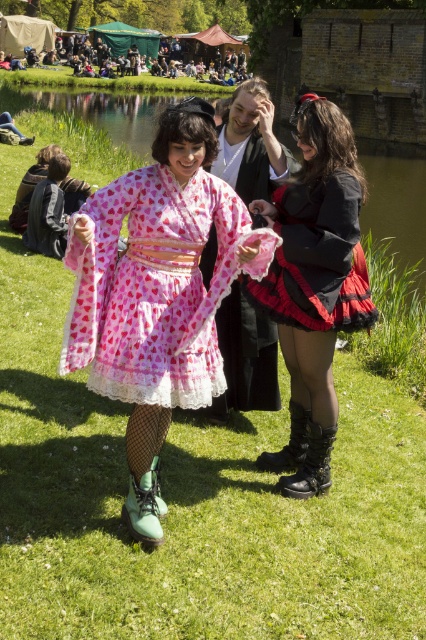
Question: Is matte black dress at center to the left of green matte boots at center from the viewer's perspective?

Choices:
 (A) yes
 (B) no

Answer: (A)

Question: Does green matte boots at center lie in front of green suede boot at lower center?

Choices:
 (A) yes
 (B) no

Answer: (B)

Question: Which object is positioned closest to the green suede boot at lower center?

Choices:
 (A) black matte boot at lower center
 (B) black leather boots at center
 (C) green matte boots at center
 (D) matte black dress at center

Answer: (C)

Question: Estimate the real-world distances between objects in this image. Which object is closer to the green suede boot at lower center?

Choices:
 (A) black leather boots at center
 (B) black matte boot at lower center

Answer: (B)

Question: Can you confirm if black leather boots at center is positioned to the right of green suede boot at lower center?

Choices:
 (A) no
 (B) yes

Answer: (B)

Question: Which of the following is the farthest from the observer?

Choices:
 (A) black matte boot at lower center
 (B) pink lace dress at center
 (C) black leather boots at center

Answer: (A)